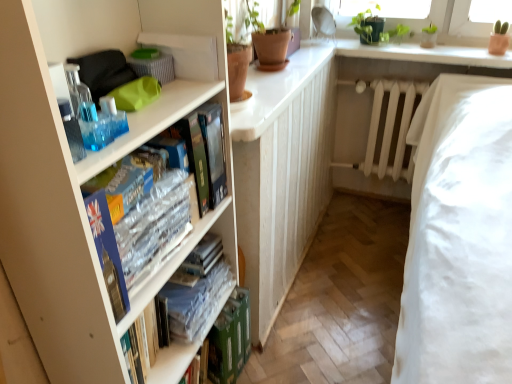
The image size is (512, 384). Find the location of `vacant area on top of clear plastic book at center, which is counted as the 2th book, starting from the top (from a real-world perspective)`. vacant area on top of clear plastic book at center, which is counted as the 2th book, starting from the top (from a real-world perspective) is located at coordinates (187, 287).